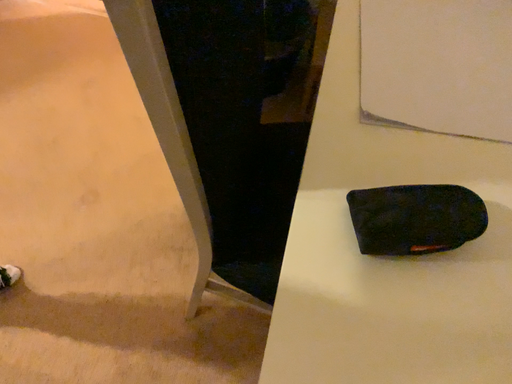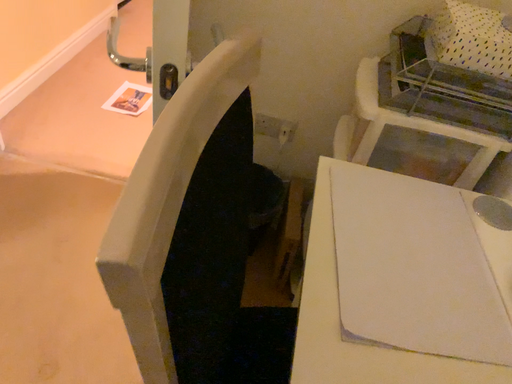
Question: Which way did the camera rotate in the video?

Choices:
 (A) rotated downward
 (B) rotated upward

Answer: (B)